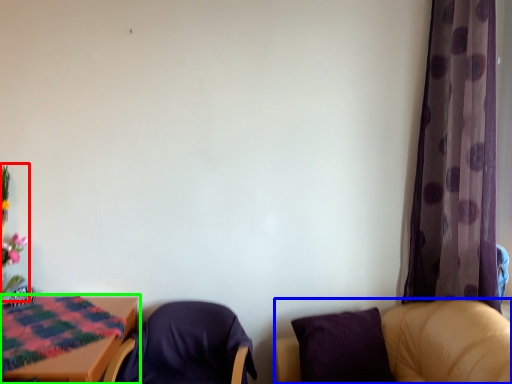
Question: Estimate the real-world distances between objects in this image. Which object is farther from floral arrangement (highlighted by a red box), chair (highlighted by a blue box) or table (highlighted by a green box)?

Choices:
 (A) chair
 (B) table

Answer: (A)